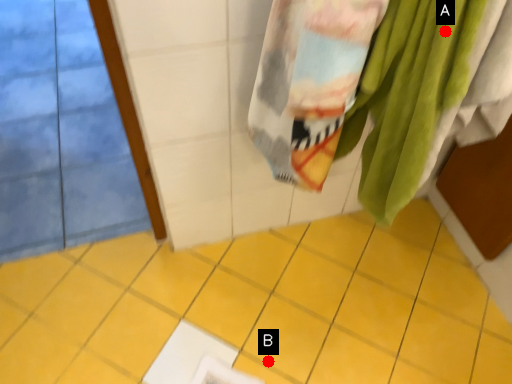
Question: Two points are circled on the image, labeled by A and B beside each circle. Among these points, which one is nearest to the camera?

Choices:
 (A) A is closer
 (B) B is closer

Answer: (A)